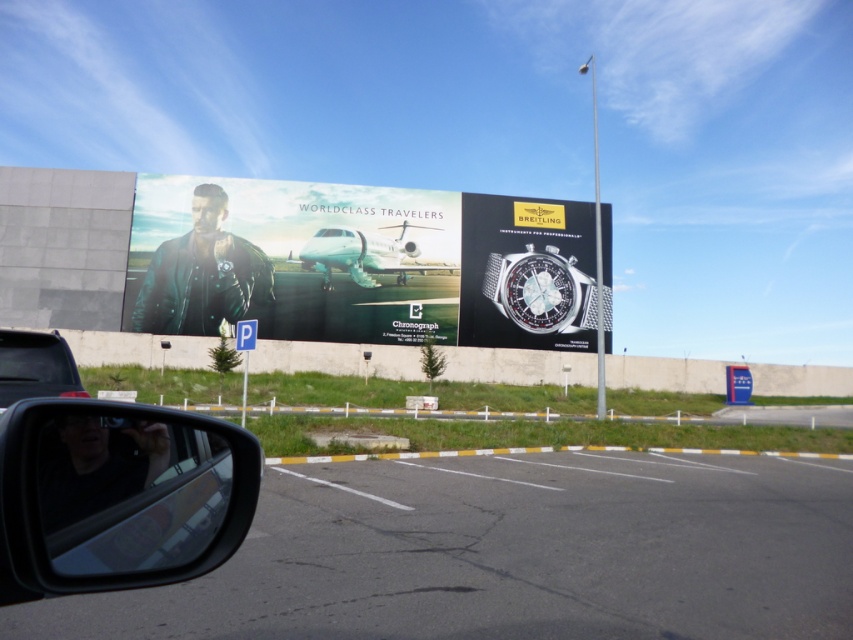
You are a delivery person who needs to place a large package that is 1.2 meters tall. The package must be placed between the matte black leather jacket at upper left and the transparent glass at lower left. Can the package fit vertically between these two objects?

The matte black leather jacket at upper left is much taller than the transparent glass at lower left, so the vertical space between them is insufficient to accommodate a package that is 1.2 meters tall.

You are a delivery driver who needs to place a new leather jacket in the exact center of the parking lot. The parking lot is represented by the coordinate system where the bottom left corner is the origin. The point at coordinate (361, 262) is currently occupied by a matte black leather jacket at upper left. Can you confirm if this jacket is placed at the center of the parking lot?

The point at coordinate (361, 262) is occupied by the matte black leather jacket at upper left, which is not the center of the parking lot. The center would be at coordinate 0.5, 0.5. Therefore, the jacket is not placed at the center.